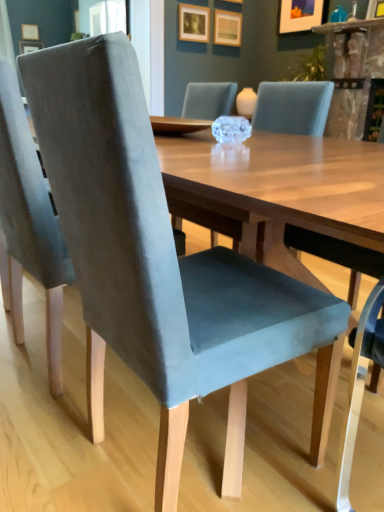
What is the approximate width of velvet blue chair at left?

velvet blue chair at left is 20.62 inches in width.

Locate an element on the screen. The height and width of the screenshot is (512, 384). velvet blue chair at left is located at coordinates (29, 224).

What is the approximate height of velvet blue chair at left?

velvet blue chair at left is 37.26 inches in height.

The height and width of the screenshot is (512, 384). What do you see at coordinates (29, 224) in the screenshot? I see `velvet blue chair at left` at bounding box center [29, 224].

Where is `velvet blue chair at left`? This screenshot has height=512, width=384. velvet blue chair at left is located at coordinates (29, 224).